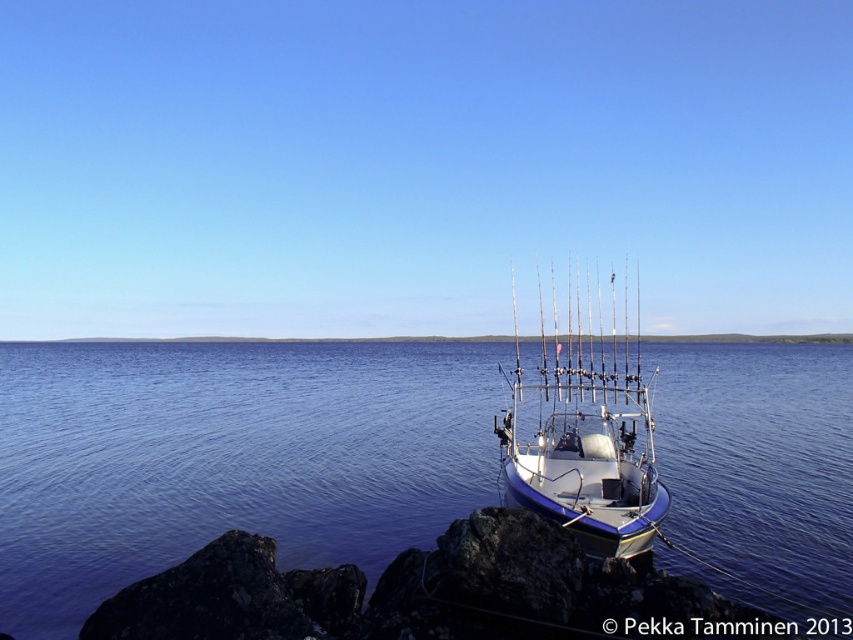
Question: Is blue water at center smaller than dark gray rock at lower center?

Choices:
 (A) no
 (B) yes

Answer: (A)

Question: Is blue water at center to the left of dark gray rock at lower center from the viewer's perspective?

Choices:
 (A) yes
 (B) no

Answer: (B)

Question: Is dark gray rock at lower center to the left of white glossy boat at center from the viewer's perspective?

Choices:
 (A) no
 (B) yes

Answer: (B)

Question: Estimate the real-world distances between objects in this image. Which object is farther from the white glossy boat at center?

Choices:
 (A) blue water at center
 (B) dark gray rock at lower center

Answer: (B)

Question: Which object is farther from the camera taking this photo?

Choices:
 (A) white glossy boat at center
 (B) dark gray rock at lower center

Answer: (A)

Question: Considering the real-world distances, which object is farthest from the dark gray rock at lower center?

Choices:
 (A) blue water at center
 (B) white glossy boat at center

Answer: (B)